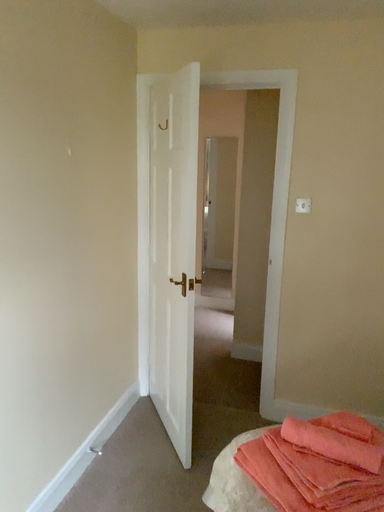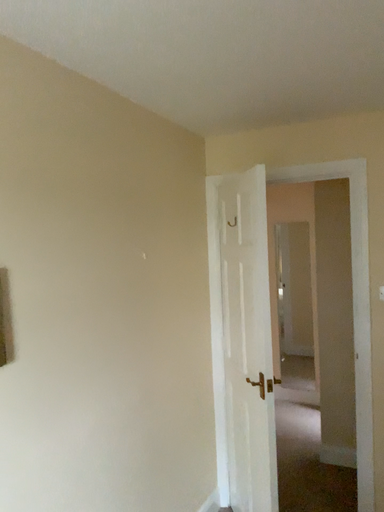
Question: Which way did the camera rotate in the video?

Choices:
 (A) rotated left
 (B) rotated right

Answer: (A)